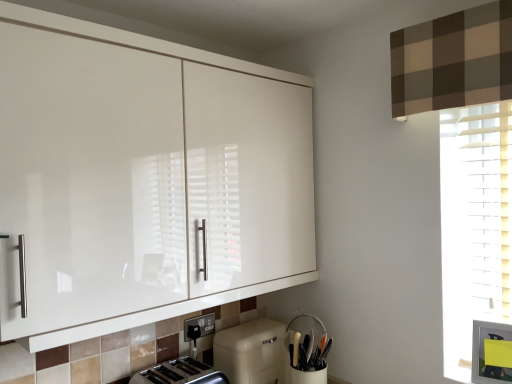
The height and width of the screenshot is (384, 512). Find the location of `vacant region above beige matte dishwasher at lower center (from a real-world perspective)`. vacant region above beige matte dishwasher at lower center (from a real-world perspective) is located at coordinates (254, 327).